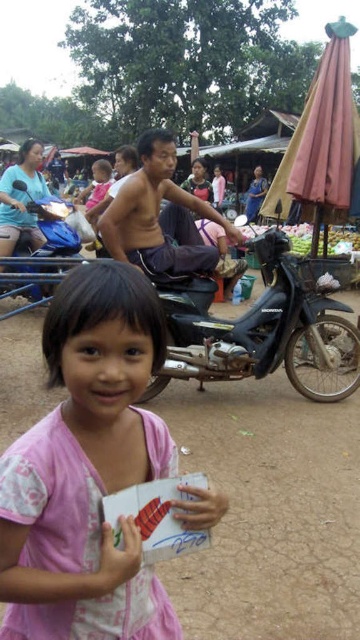
You are a photographer standing at the edge of the market. You want to take a photo of the shiny purple pants at center and the blue matte motorcycle at center. Which object should you focus on first to ensure it appears sharp in the photo?

The shiny purple pants at center is closer to you than the blue matte motorcycle at center, so you should focus on the shiny purple pants at center first to ensure it appears sharp in the photo.

You are a photographer trying to capture a photo of the pink fabric child at center and the blue matte motorcycle at center. If you want to ensure both subjects are in focus, which one should you adjust your camera focus on first?

The pink fabric child at center is smaller than the blue matte motorcycle at center, so you should focus on the blue matte motorcycle at center first to ensure proper depth of field for both subjects.

You are a delivery person who needs to quickly pass between the pink fabric child at center and the shiny purple pants at center. Your delivery cart is 2 meters wide. Can you safely navigate through the gap between them?

The distance between the pink fabric child at center and the shiny purple pants at center is 2.60 meters. Since your delivery cart is 2 meters wide, you can safely navigate through the gap as it is wider than the cart.